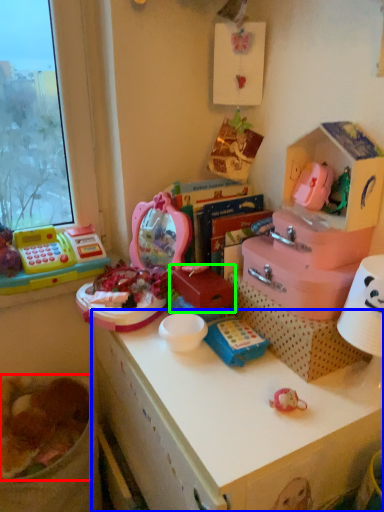
Question: Which object is the farthest from food (highlighted by a red box)? Choose among these: desk (highlighted by a blue box) or box (highlighted by a green box).

Choices:
 (A) desk
 (B) box

Answer: (B)